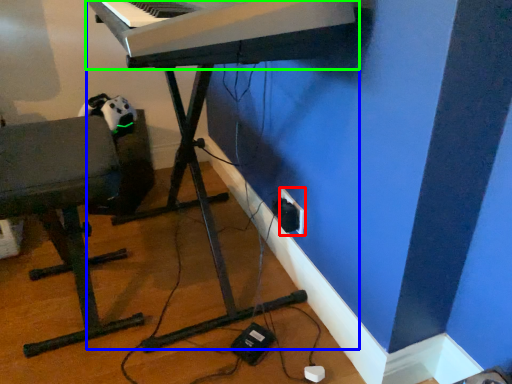
Question: Considering the real-world distances, which object is farthest from electric outlet (highlighted by a red box)? piano (highlighted by a blue box) or musical keyboard (highlighted by a green box)?

Choices:
 (A) piano
 (B) musical keyboard

Answer: (B)